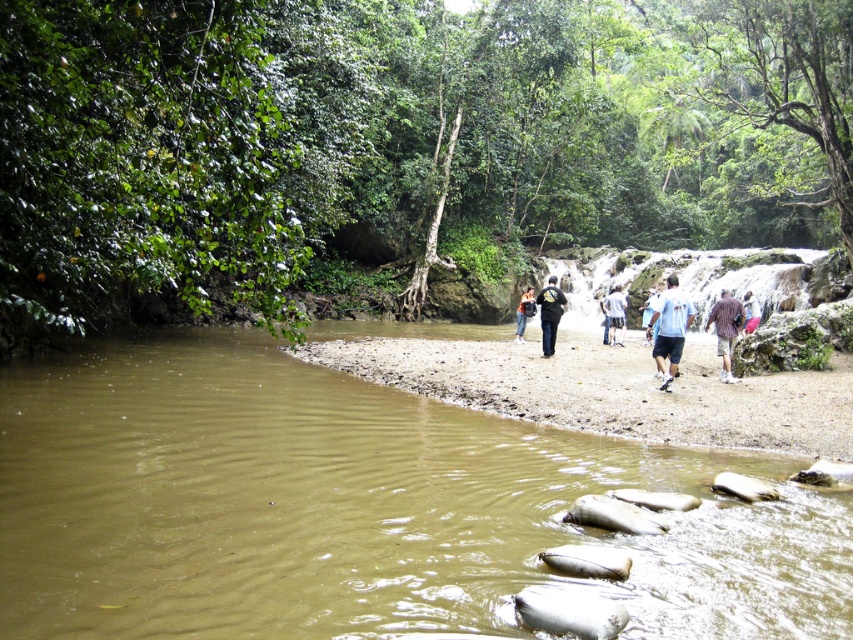
Question: Is pink fabric pants at lower right positioned behind blue fabric shirt at center?

Choices:
 (A) no
 (B) yes

Answer: (B)

Question: Which object is positioned closest to the blue fabric shirt at center?

Choices:
 (A) dark blue jeans at center
 (B) green leafy jungle at upper left

Answer: (A)

Question: Which object is closer to the camera taking this photo?

Choices:
 (A) light blue fabric shirt at center
 (B) green leafy jungle at upper left
 (C) brown cotton shirt at center-right

Answer: (B)

Question: Which of the following is the closest to the observer?

Choices:
 (A) pink fabric pants at lower right
 (B) green leafy jungle at upper left
 (C) white cotton shirt at center
 (D) blue fabric shirt at center

Answer: (B)

Question: Is dark blue jeans at center below white cotton shirt at center?

Choices:
 (A) yes
 (B) no

Answer: (B)

Question: Is matte black backpack at center smaller than pink fabric pants at lower right?

Choices:
 (A) yes
 (B) no

Answer: (A)